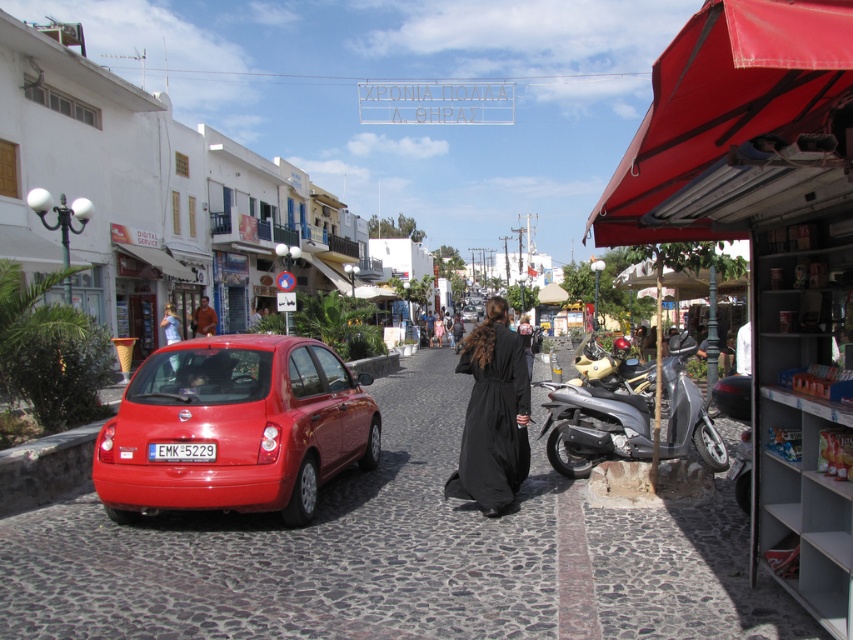
Is point (236, 394) in front of point (775, 122)?

No, (236, 394) is further to viewer.

Can you confirm if glossy red car at left is positioned above red fabric canopy at right?

No, glossy red car at left is not above red fabric canopy at right.

What are the coordinates of `glossy red car at left` in the screenshot? It's located at (234, 428).

Does black matte dress at center appear on the left side of shiny chrome motorcycle at center-right?

Correct, you'll find black matte dress at center to the left of shiny chrome motorcycle at center-right.

Which is below, black matte dress at center or shiny chrome motorcycle at center-right?

black matte dress at center is below.

Which is behind, point (491, 388) or point (582, 349)?

The point (582, 349) is more distant.

Locate an element on the screen. Image resolution: width=853 pixels, height=640 pixels. black matte dress at center is located at coordinates (492, 413).

Is silver metallic scooter at right taller than brown leather jacket at center?

Correct, silver metallic scooter at right is much taller as brown leather jacket at center.

Between silver metallic scooter at right and brown leather jacket at center, which one is positioned higher?

Positioned higher is brown leather jacket at center.

Describe the element at coordinates (595, 428) in the screenshot. This screenshot has width=853, height=640. I see `silver metallic scooter at right` at that location.

At what (x,y) coordinates should I click in order to perform the action: click on silver metallic scooter at right. Please return your answer as a coordinate pair (x, y). This screenshot has width=853, height=640. Looking at the image, I should click on (595, 428).